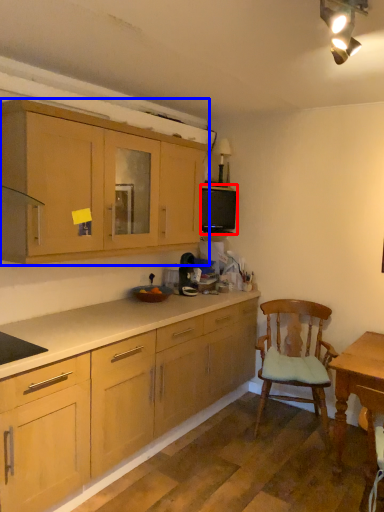
Question: Among these objects, which one is farthest to the camera, appliance (highlighted by a red box) or cabinetry (highlighted by a blue box)?

Choices:
 (A) appliance
 (B) cabinetry

Answer: (A)